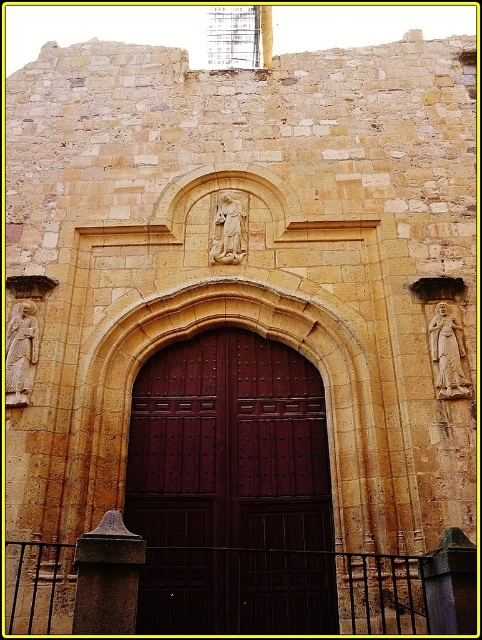
Question: Which object appears closest to the camera in this image?

Choices:
 (A) white marble statue at center
 (B) white stone statue at left
 (C) white stone statue at right
 (D) dark wood door at center

Answer: (D)

Question: Is white stone statue at right closer to camera compared to white marble statue at center?

Choices:
 (A) yes
 (B) no

Answer: (A)

Question: Which of these objects is positioned farthest from the white stone statue at left?

Choices:
 (A) white stone statue at right
 (B) white marble statue at center

Answer: (A)

Question: Can you confirm if dark wood door at center is smaller than white stone statue at right?

Choices:
 (A) yes
 (B) no

Answer: (B)

Question: Which of these objects is positioned closest to the white marble statue at center?

Choices:
 (A) white stone statue at right
 (B) white stone statue at left

Answer: (B)

Question: Does white stone statue at right lie in front of white marble statue at center?

Choices:
 (A) yes
 (B) no

Answer: (A)